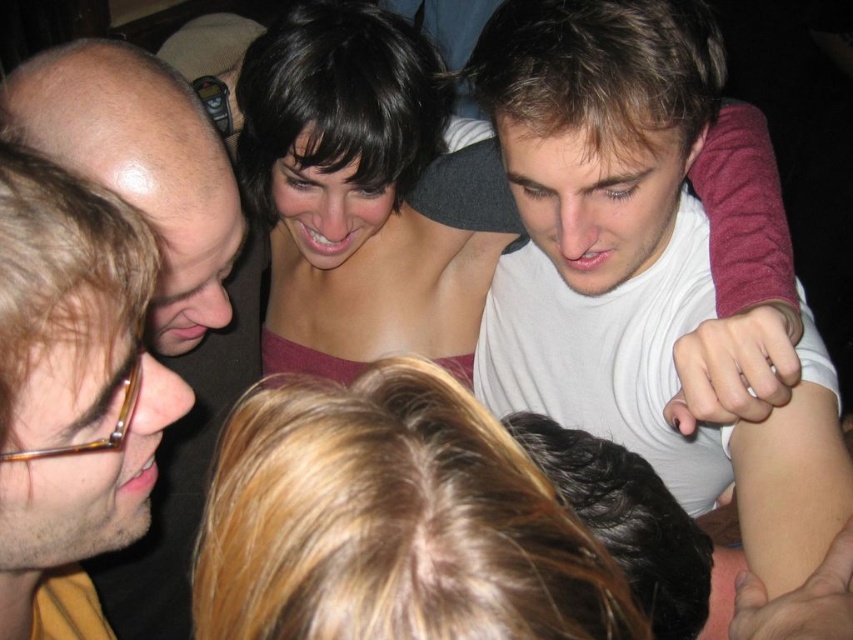
Can you confirm if white matte shirt at upper right is positioned below blonde hair at center?

No, white matte shirt at upper right is not below blonde hair at center.

Is white matte shirt at upper right shorter than blonde hair at center?

No.

This screenshot has height=640, width=853. What are the coordinates of `white matte shirt at upper right` in the screenshot? It's located at (635, 264).

Is blonde hair at center closer to the viewer compared to matte pink dress at center?

Yes.

Where is `blonde hair at center`? The height and width of the screenshot is (640, 853). blonde hair at center is located at coordinates (392, 522).

Identify the location of blonde hair at center. The width and height of the screenshot is (853, 640). (392, 522).

Does point (428, 58) lie in front of point (102, 77)?

No.

What do you see at coordinates (364, 180) in the screenshot? The height and width of the screenshot is (640, 853). I see `matte pink dress at center` at bounding box center [364, 180].

Find the location of `matte pink dress at center`. matte pink dress at center is located at coordinates click(x=364, y=180).